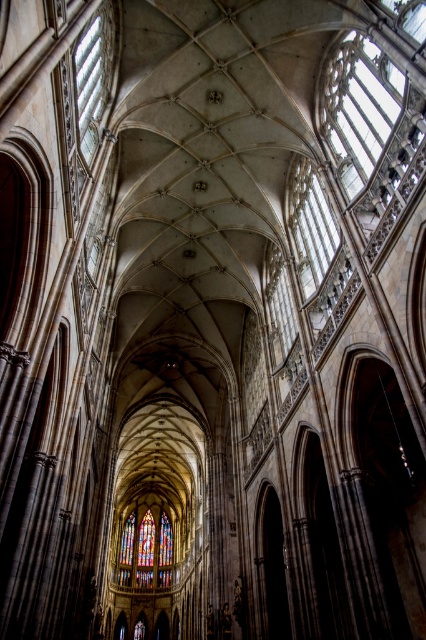
You are an architect examining the cathedral. You notice the clear glass at upper right and the stained glass at center. Which of these two windows is positioned higher in the cathedral?

The clear glass at upper right is located above the stained glass at center, so it is positioned higher in the cathedral.

You are an architect examining the cathedral. You notice the clear glass window at upper left and the stained glass at center. Which of these two windows is positioned higher up in the cathedral?

The clear glass window at upper left is positioned higher up in the cathedral than the stained glass at center because it is above it.